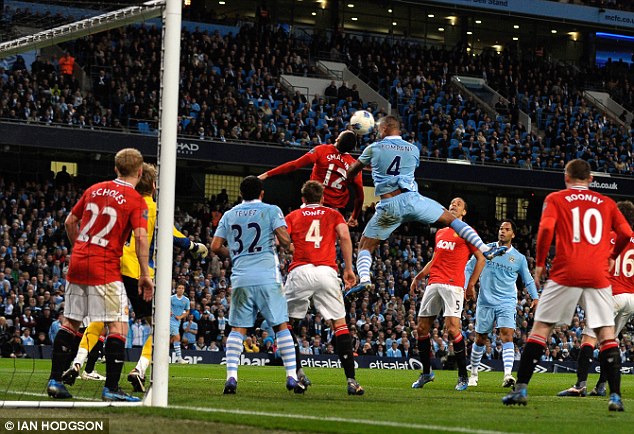
At what (x,y) coordinates should I click in order to perform the action: click on entrance. Please return your answer as a coordinate pair (x, y). The height and width of the screenshot is (434, 634). Looking at the image, I should click on (55, 166), (503, 208), (526, 211).